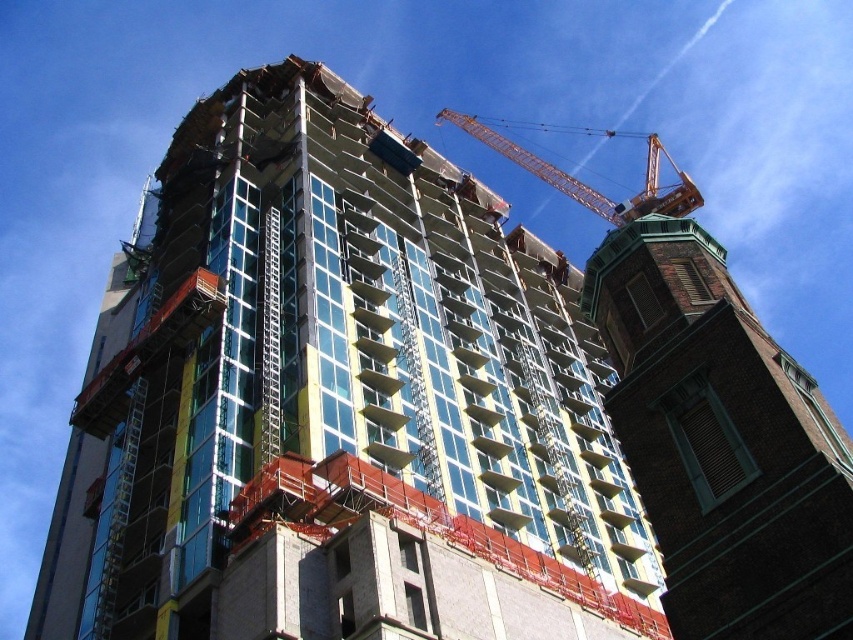
Describe the element at coordinates (338, 403) in the screenshot. This screenshot has height=640, width=853. I see `glassy concrete building at center` at that location.

Can you confirm if glassy concrete building at center is taller than orange metallic crane at upper center?

No.

Which is in front, point (344, 460) or point (526, 157)?

Point (344, 460) is more forward.

Find the location of `glassy concrete building at center`. glassy concrete building at center is located at coordinates (338, 403).

Between brown brick tower at right and orange metallic crane at upper center, which one is positioned higher?

orange metallic crane at upper center is higher up.

Does brown brick tower at right lie in front of orange metallic crane at upper center?

Yes, brown brick tower at right is closer to the viewer.

Between point (724, 392) and point (622, 205), which one is positioned behind?

The point (622, 205) is more distant.

What are the coordinates of `brown brick tower at right` in the screenshot? It's located at (722, 442).

Consider the image. Is glassy concrete building at center above brown brick tower at right?

Yes.

This screenshot has height=640, width=853. Describe the element at coordinates (338, 403) in the screenshot. I see `glassy concrete building at center` at that location.

Image resolution: width=853 pixels, height=640 pixels. What are the coordinates of `glassy concrete building at center` in the screenshot? It's located at (338, 403).